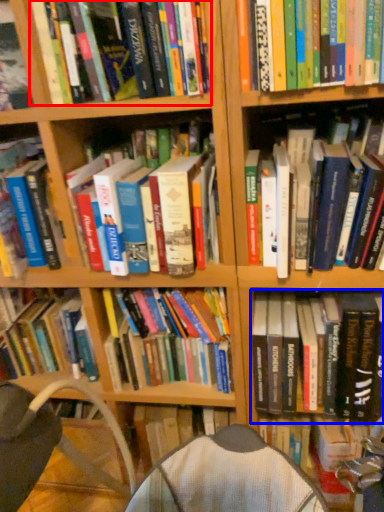
Question: Which object is further to the camera taking this photo, book (highlighted by a red box) or book (highlighted by a blue box)?

Choices:
 (A) book
 (B) book

Answer: (B)